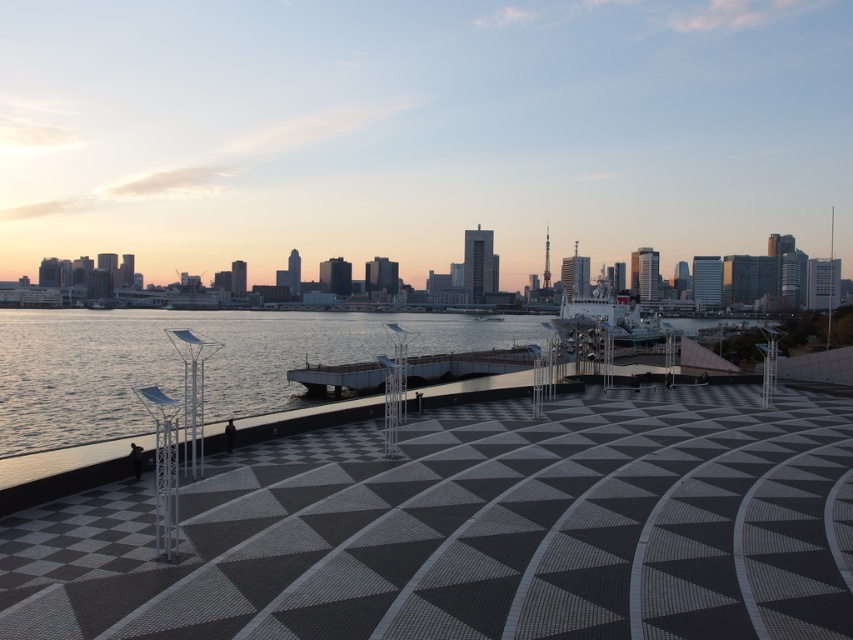
Question: Observing the image, what is the correct spatial positioning of clear water at lower left in reference to shiny metallic ship at center?

Choices:
 (A) above
 (B) below

Answer: (B)

Question: Which point is closer to the camera?

Choices:
 (A) clear water at lower left
 (B) shiny metallic ship at center

Answer: (A)

Question: Which object appears farthest from the camera in this image?

Choices:
 (A) clear water at lower left
 (B) shiny metallic ship at center

Answer: (B)

Question: Which of the following is the farthest from the observer?

Choices:
 (A) (558, 330)
 (B) (112, 413)

Answer: (A)

Question: Is clear water at lower left positioned in front of shiny metallic ship at center?

Choices:
 (A) yes
 (B) no

Answer: (A)

Question: In this image, where is clear water at lower left located relative to shiny metallic ship at center?

Choices:
 (A) below
 (B) above

Answer: (A)